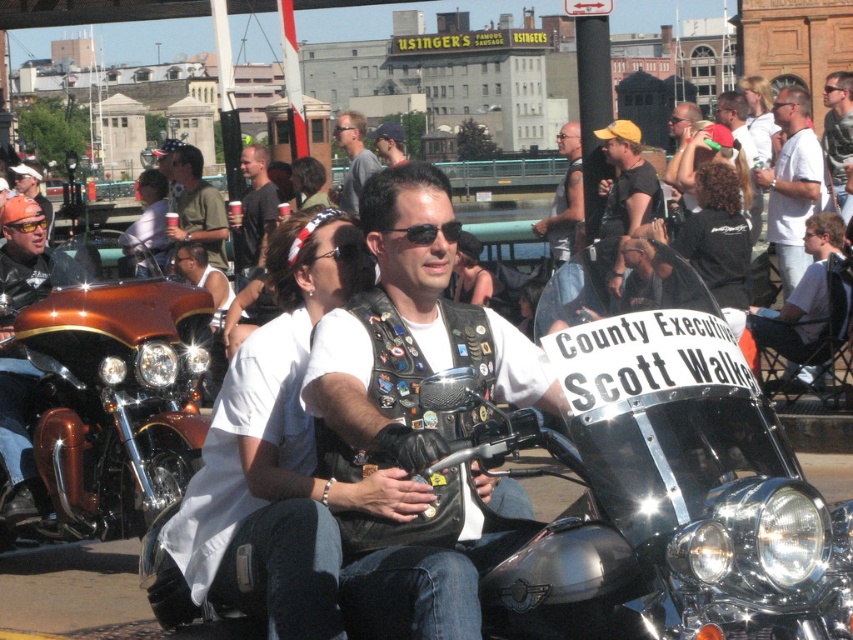
Question: Which object is farther from the camera taking this photo?

Choices:
 (A) white cotton shirt at upper center
 (B) matte khaki shirt at center

Answer: (B)

Question: Is shiny gold motorcycle at left to the left of matte khaki shirt at center from the viewer's perspective?

Choices:
 (A) no
 (B) yes

Answer: (A)

Question: Is shiny chrome motorcycle at center above sunglasses at center?

Choices:
 (A) yes
 (B) no

Answer: (B)

Question: Estimate the real-world distances between objects in this image. Which object is closer to the matte gray shirt at center?

Choices:
 (A) sunglasses at center
 (B) leather vest at center

Answer: (B)

Question: Which point appears closest to the camera in this image?

Choices:
 (A) (498, 580)
 (B) (189, 227)
 (C) (412, 230)

Answer: (A)

Question: Observing the image, what is the correct spatial positioning of shiny chrome motorcycle at center in reference to dark gray t-shirt at center?

Choices:
 (A) right
 (B) left

Answer: (A)